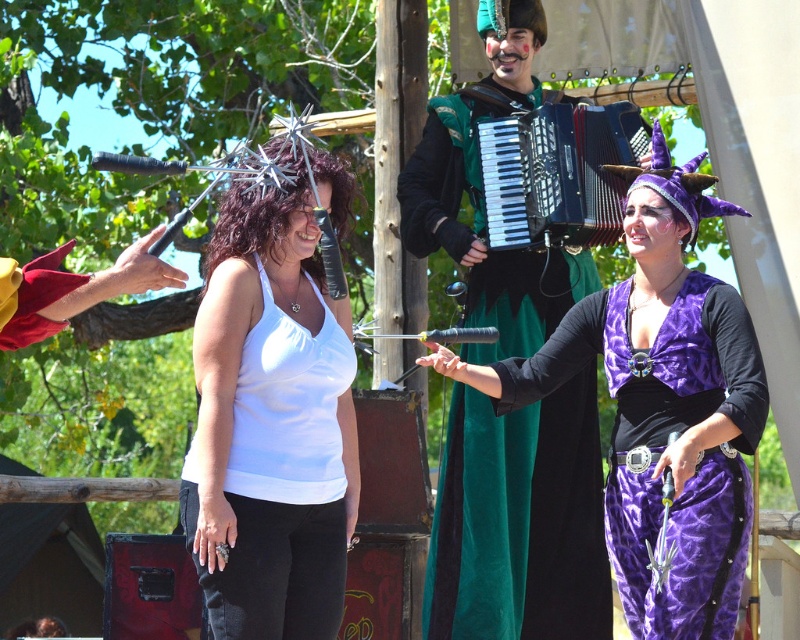
You are a performer in a parade carrying a 6.5 feet long pole. You need to pass between the white matte tank top at center and the black plastic accordion at center. Can you fit through the space between them without touching either?

The distance between the white matte tank top at center and the black plastic accordion at center is 8.11 feet. Since the pole is 6.5 feet long, it can fit through the space as the distance is greater than the pole length.

You are a photographer at the festival and want to capture both the white matte tank top at center and the velvet green accordion at center in a single photo. Can you focus on both clearly at the same time?

The white matte tank top at center is in front of the velvet green accordion at center, so focusing on both clearly at the same time may be challenging due to their different distances from the camera.